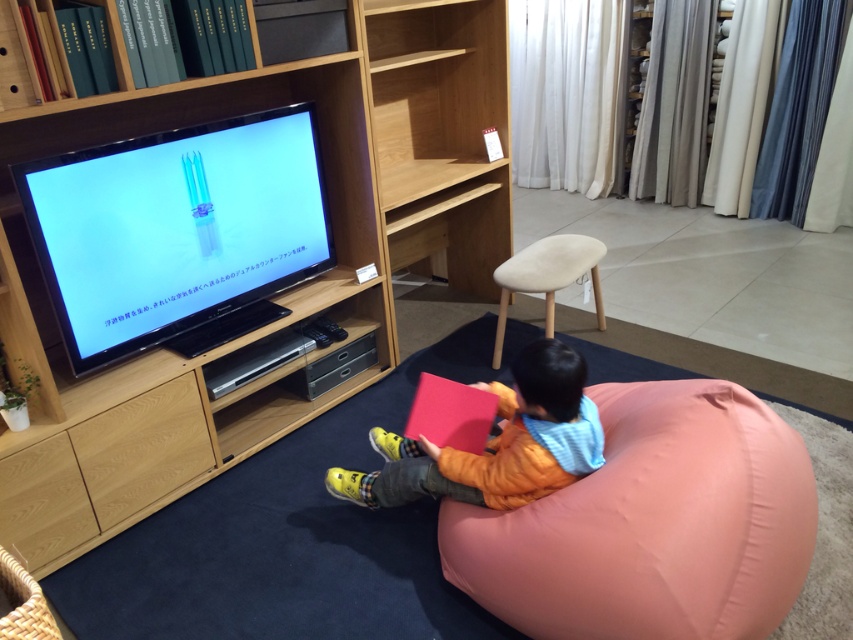
Question: Does wooden entertainment center at left appear on the left side of orange fabric bean bag at lower center?

Choices:
 (A) yes
 (B) no

Answer: (A)

Question: Does wooden entertainment center at left have a smaller size compared to pink fabric bean bag at lower center?

Choices:
 (A) no
 (B) yes

Answer: (A)

Question: Which object is positioned farthest from the beige fabric stool at upper right?

Choices:
 (A) pink fabric bean bag at lower center
 (B) orange fabric bean bag at lower center
 (C) wooden entertainment center at left

Answer: (A)

Question: Which of the following is the closest to the observer?

Choices:
 (A) wooden entertainment center at left
 (B) pink fabric bean bag at lower center
 (C) beige fabric stool at upper right

Answer: (B)

Question: Can you confirm if wooden entertainment center at left is smaller than orange fabric bean bag at lower center?

Choices:
 (A) no
 (B) yes

Answer: (A)

Question: Which of these objects is positioned closest to the orange fabric bean bag at lower center?

Choices:
 (A) beige fabric stool at upper right
 (B) wooden entertainment center at left

Answer: (A)